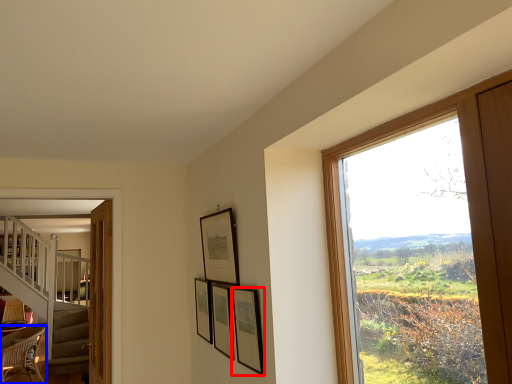
Question: Which point is closer to the camera, picture frame (highlighted by a red box) or chair (highlighted by a blue box)?

Choices:
 (A) picture frame
 (B) chair

Answer: (A)